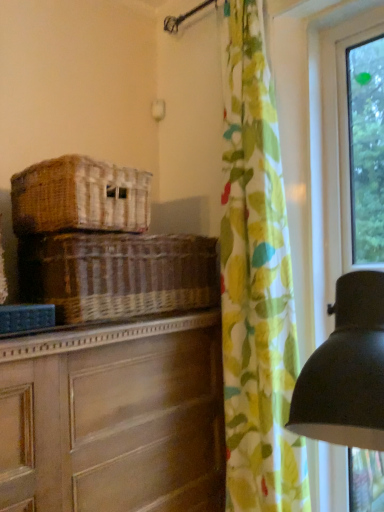
Question: Is wooden chest of drawers at left wider than woven brown basket at left, which is counted as the 2th basket, starting from the bottom?

Choices:
 (A) no
 (B) yes

Answer: (B)

Question: Does wooden chest of drawers at left have a greater height compared to woven brown basket at left, arranged as the first basket when viewed from the top?

Choices:
 (A) yes
 (B) no

Answer: (A)

Question: Does wooden chest of drawers at left have a larger size compared to woven brown basket at left, arranged as the first basket when viewed from the top?

Choices:
 (A) yes
 (B) no

Answer: (A)

Question: Could you tell me if wooden chest of drawers at left is facing woven brown basket at left, arranged as the first basket when viewed from the top?

Choices:
 (A) yes
 (B) no

Answer: (B)

Question: Is wooden chest of drawers at left oriented away from woven brown basket at left, arranged as the first basket when viewed from the top?

Choices:
 (A) no
 (B) yes

Answer: (A)

Question: Does wooden chest of drawers at left appear on the left side of woven brown basket at left, which is counted as the 2th basket, starting from the bottom?

Choices:
 (A) yes
 (B) no

Answer: (B)

Question: From the image's perspective, does woven brown basket at center, which is the first basket in bottom-to-top order, appear higher than woven brown basket at left, which is counted as the 2th basket, starting from the bottom?

Choices:
 (A) no
 (B) yes

Answer: (A)

Question: Is woven brown basket at center, the second basket in the top-to-bottom sequence, placed right next to woven brown basket at left, arranged as the first basket when viewed from the top?

Choices:
 (A) no
 (B) yes

Answer: (A)

Question: Is woven brown basket at center, which is the first basket in bottom-to-top order, facing towards woven brown basket at left, which is counted as the 2th basket, starting from the bottom?

Choices:
 (A) no
 (B) yes

Answer: (A)

Question: From a real-world perspective, does woven brown basket at center, which is the first basket in bottom-to-top order, sit lower than woven brown basket at left, which is counted as the 2th basket, starting from the bottom?

Choices:
 (A) no
 (B) yes

Answer: (B)

Question: Is woven brown basket at center, which is the first basket in bottom-to-top order, far away from woven brown basket at left, arranged as the first basket when viewed from the top?

Choices:
 (A) yes
 (B) no

Answer: (B)

Question: Is woven brown basket at center, which is the first basket in bottom-to-top order, facing away from woven brown basket at left, arranged as the first basket when viewed from the top?

Choices:
 (A) no
 (B) yes

Answer: (A)

Question: Does woven brown basket at center, the second basket in the top-to-bottom sequence, turn towards floral fabric curtain at right?

Choices:
 (A) no
 (B) yes

Answer: (B)